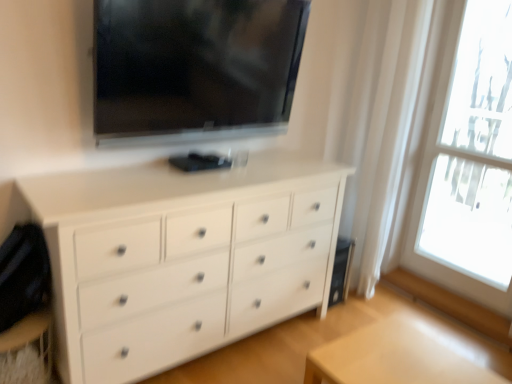
Question: Relative to black glossy tv at upper center, is white matte chest of drawers at center in front or behind?

Choices:
 (A) front
 (B) behind

Answer: (A)

Question: From a real-world perspective, is white matte chest of drawers at center physically located above or below black glossy tv at upper center?

Choices:
 (A) below
 (B) above

Answer: (A)

Question: Considering the real-world distances, which object is farthest from the transparent glass window at right?

Choices:
 (A) white matte chest of drawers at center
 (B) light wood table at lower right
 (C) black glossy tv at upper center

Answer: (B)

Question: Considering the real-world distances, which object is farthest from the light wood table at lower right?

Choices:
 (A) black glossy tv at upper center
 (B) transparent glass window at right
 (C) white matte chest of drawers at center

Answer: (B)